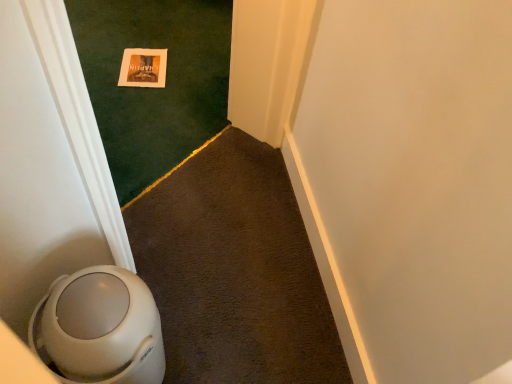
Find the location of a particular element. brown carpet at center is located at coordinates (234, 270).

Describe the element at coordinates (234, 270) in the screenshot. I see `brown carpet at center` at that location.

The width and height of the screenshot is (512, 384). In order to click on brown carpet at center in this screenshot , I will do `click(234, 270)`.